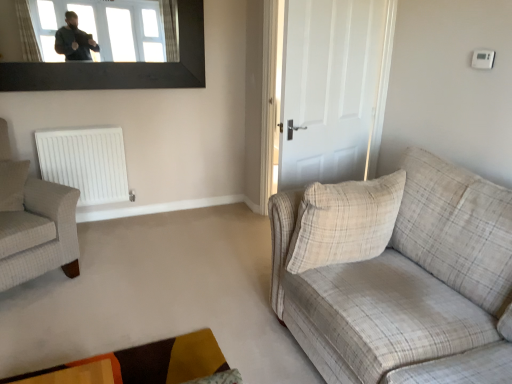
Question: Would you say velvet-like brown and orange rug at lower center is outside plaid fabric armchair at left?

Choices:
 (A) yes
 (B) no

Answer: (A)

Question: Does velvet-like brown and orange rug at lower center turn towards plaid fabric armchair at left?

Choices:
 (A) yes
 (B) no

Answer: (B)

Question: Does velvet-like brown and orange rug at lower center appear on the left side of plaid fabric armchair at left?

Choices:
 (A) no
 (B) yes

Answer: (A)

Question: From a real-world perspective, is velvet-like brown and orange rug at lower center positioned over plaid fabric armchair at left based on gravity?

Choices:
 (A) no
 (B) yes

Answer: (A)

Question: Can plaid fabric armchair at left be found inside velvet-like brown and orange rug at lower center?

Choices:
 (A) yes
 (B) no

Answer: (B)

Question: Is velvet-like brown and orange rug at lower center next to plaid fabric armchair at left and touching it?

Choices:
 (A) yes
 (B) no

Answer: (B)

Question: Does beige plaid pillow at left, positioned as the second pillow in front-to-back order, have a greater width compared to transparent glass window at upper center?

Choices:
 (A) no
 (B) yes

Answer: (B)

Question: Considering the relative sizes of beige plaid pillow at left, which is counted as the 1th pillow, starting from the back, and transparent glass window at upper center in the image provided, is beige plaid pillow at left, which is counted as the 1th pillow, starting from the back, taller than transparent glass window at upper center?

Choices:
 (A) no
 (B) yes

Answer: (A)

Question: Is beige plaid pillow at left, the 2th pillow from the right, oriented towards transparent glass window at upper center?

Choices:
 (A) yes
 (B) no

Answer: (B)

Question: Does beige plaid pillow at left, the 2th pillow from the right, appear on the left side of transparent glass window at upper center?

Choices:
 (A) yes
 (B) no

Answer: (A)

Question: Does beige plaid pillow at left, which is counted as the 1th pillow, starting from the back, have a lesser width compared to transparent glass window at upper center?

Choices:
 (A) yes
 (B) no

Answer: (B)

Question: Are beige plaid pillow at left, positioned as the second pillow in front-to-back order, and transparent glass window at upper center far apart?

Choices:
 (A) no
 (B) yes

Answer: (B)

Question: From the image's perspective, is white matte door at center over velvet-like brown and orange rug at lower center?

Choices:
 (A) no
 (B) yes

Answer: (B)